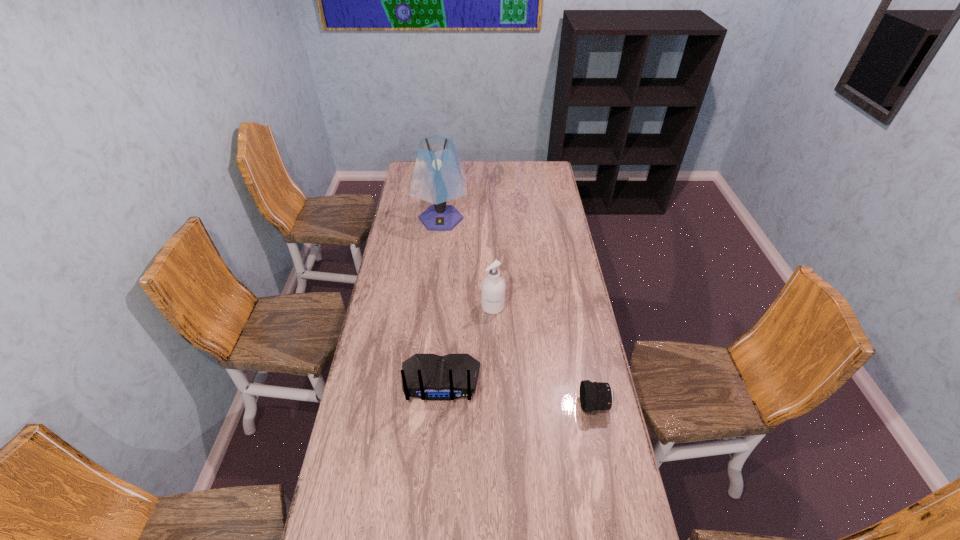
Image resolution: width=960 pixels, height=540 pixels. Find the location of `vacant region at the far right corner`. vacant region at the far right corner is located at coordinates (530, 177).

Find the location of a particular element. This screenshot has height=540, width=960. vacant space that's between the second tallest object and the telephoto lens is located at coordinates (543, 356).

Find the location of a particular element. free space between the tallest object and the rightmost object is located at coordinates (517, 312).

Locate an element on the screen. This screenshot has width=960, height=540. unoccupied position between the router and the tallest object is located at coordinates (441, 300).

Where is `empty location between the rightmost object and the router`? empty location between the rightmost object and the router is located at coordinates (517, 393).

You are a GUI agent. You are given a task and a screenshot of the screen. Output one action in this format:
    pyautogui.click(x=<x>, y=<y>)
    Task: Click on the vacant space in between the cleansing agent and the tallest object
    
    Given the screenshot: What is the action you would take?
    pyautogui.click(x=467, y=263)

The height and width of the screenshot is (540, 960). What are the coordinates of `free spot between the rightmost object and the tallest object` in the screenshot? It's located at (517, 312).

Locate an element on the screen. free spot between the second object from right to left and the rightmost object is located at coordinates (543, 356).

Locate an element on the screen. free area in between the router and the lampshade is located at coordinates (441, 300).

This screenshot has width=960, height=540. Find the location of `free area in between the telephoto lens and the router`. free area in between the telephoto lens and the router is located at coordinates (517, 393).